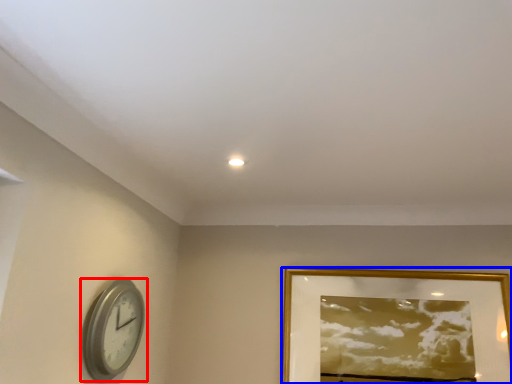
Question: Which of the following is the farthest to the observer, wall clock (highlighted by a red box) or picture frame (highlighted by a blue box)?

Choices:
 (A) wall clock
 (B) picture frame

Answer: (B)